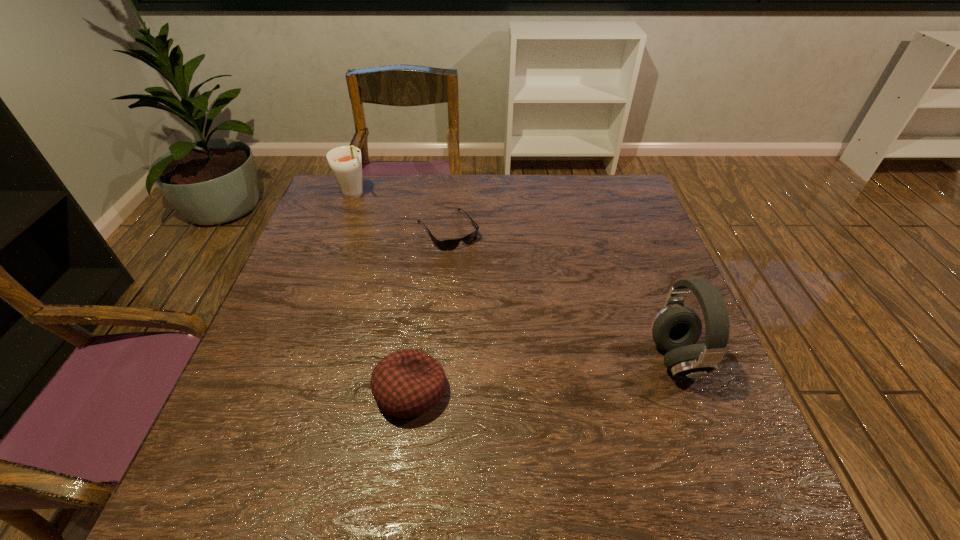
Identify the location of vacant region located on the drink side of the root beer. The width and height of the screenshot is (960, 540). (380, 222).

The width and height of the screenshot is (960, 540). I want to click on vacant space located 0.180m on the drink side of the root beer, so click(390, 233).

Where is `free location located on the drink side of the root beer`? The width and height of the screenshot is (960, 540). free location located on the drink side of the root beer is located at coordinates (381, 224).

Find the location of a particular element. sunglasses located in the far edge section of the desktop is located at coordinates (445, 245).

Where is `root beer that is at the far edge`? root beer that is at the far edge is located at coordinates (345, 162).

Locate an element on the screen. The height and width of the screenshot is (540, 960). object that is at the near edge is located at coordinates (407, 383).

Where is `object located at the left edge`? This screenshot has width=960, height=540. object located at the left edge is located at coordinates (345, 162).

Locate an element on the screen. object at the right edge is located at coordinates coord(675,329).

Locate an element on the screen. object that is positioned at the far left corner is located at coordinates (345, 162).

This screenshot has height=540, width=960. I want to click on vacant space at the far edge of the desktop, so click(x=506, y=207).